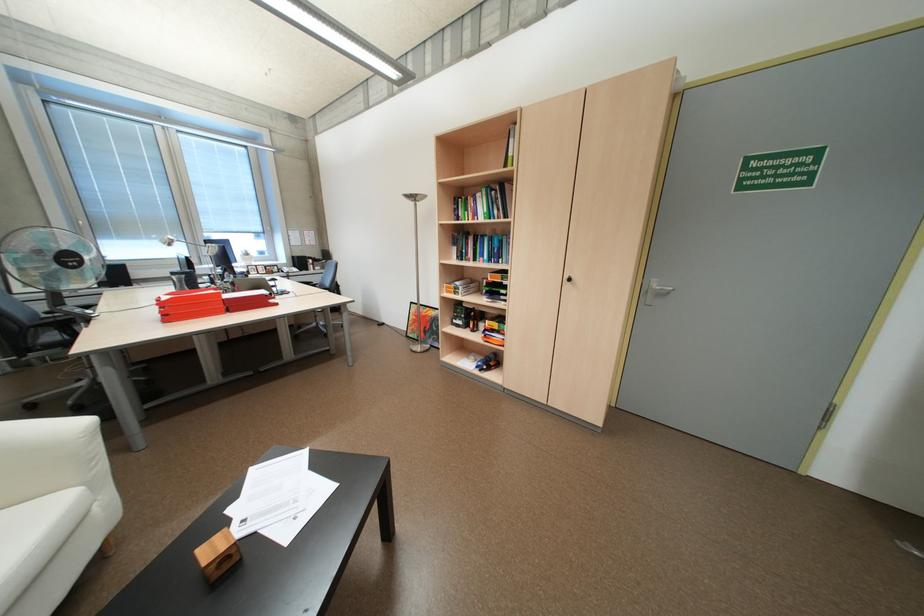
What are the coordinates of `silver door handle` in the screenshot? It's located at (655, 291).